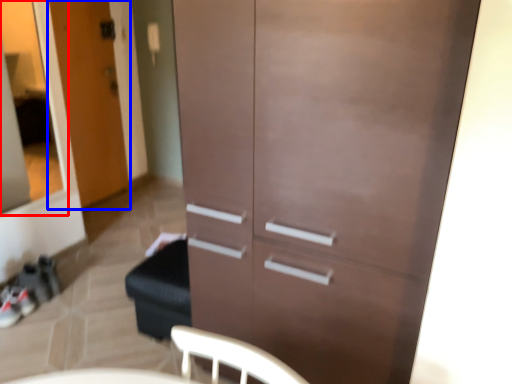
Question: Which point is closer to the camera, glass door (highlighted by a red box) or door (highlighted by a blue box)?

Choices:
 (A) glass door
 (B) door

Answer: (A)